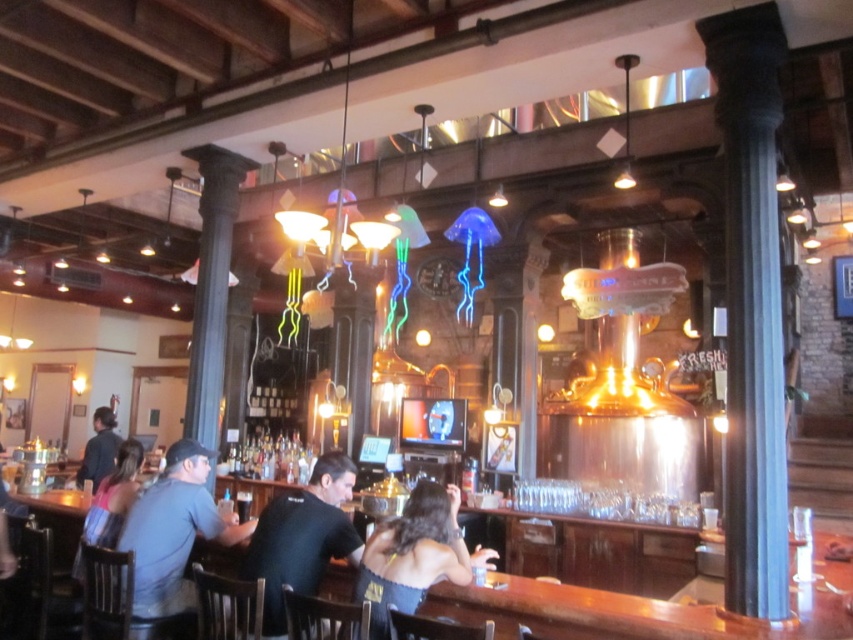
You are a customer at the bar and want to grab both items located at point (135, 552) and point (99, 476). Which item should you reach for first to minimize the distance traveled?

You should reach for the item at point (135, 552) first because it is closer to you than point (99, 476), so grabbing it first would require less movement.

You are a bartender preparing to serve drinks. You see the black satin dress at center and the dark blue shirt at left on the bar counter. Which item is positioned higher up?

The black satin dress at center is located above the dark blue shirt at left, so it is positioned higher up.